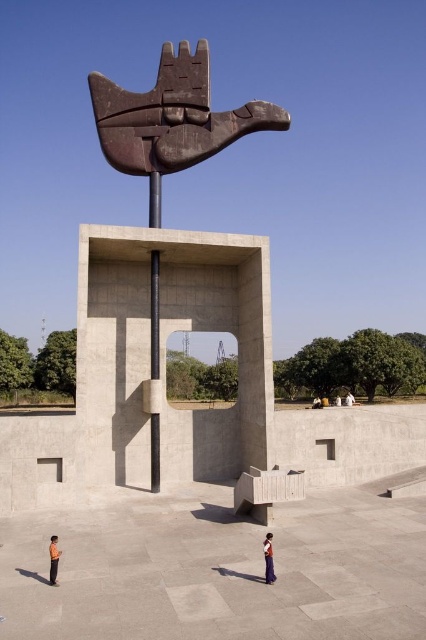
Based on the photo, between orange shirt at lower left and light brown wooden bench at center, which one is positioned lower?

light brown wooden bench at center

Who is shorter, orange shirt at lower left or light brown wooden bench at center?

With less height is orange shirt at lower left.

Describe the element at coordinates (54, 560) in the screenshot. The width and height of the screenshot is (426, 640). I see `orange shirt at lower left` at that location.

Identify the location of orange shirt at lower left. (54, 560).

Is point (158, 193) less distant than point (345, 400)?

That is True.

Does dark brown polished hand at center appear under light brown wooden bench at center?

No, dark brown polished hand at center is not below light brown wooden bench at center.

Is point (127, 99) behind point (350, 396)?

No.

You are a GUI agent. You are given a task and a screenshot of the screen. Output one action in this format:
    pyautogui.click(x=<x>, y=<y>)
    Task: Click on the dark brown polished hand at center
    The width and height of the screenshot is (426, 640).
    Given the screenshot: What is the action you would take?
    pyautogui.click(x=170, y=120)

Is point (273, 580) positioned after point (51, 561)?

No, it is not.

Does point (268, 552) come closer to viewer compared to point (51, 540)?

Yes, point (268, 552) is closer to viewer.

Image resolution: width=426 pixels, height=640 pixels. I want to click on orange fabric pants at center, so [x=268, y=557].

The image size is (426, 640). I want to click on orange fabric pants at center, so click(x=268, y=557).